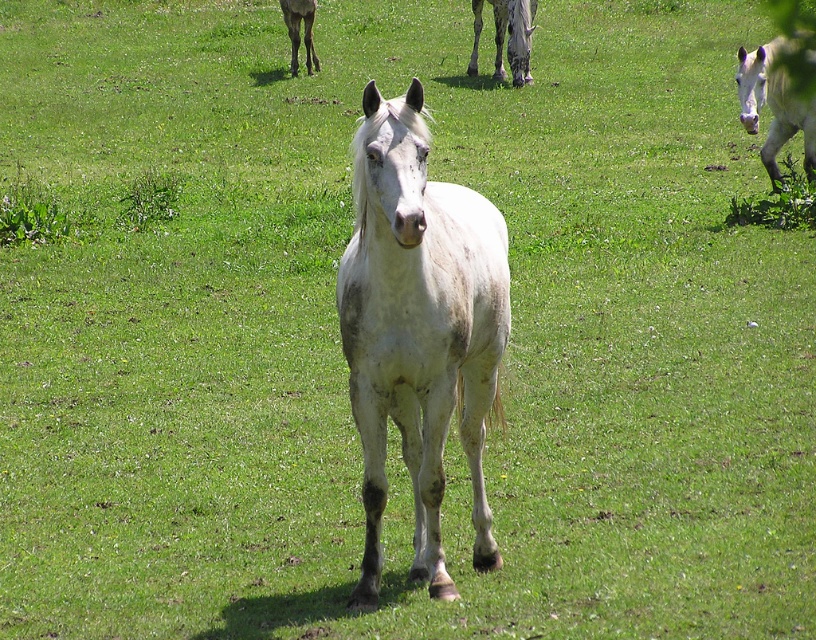
From the picture: You are a photographer trying to capture both the white matte horse at upper right and the speckled gray horse at upper center in a single frame. Based on their sizes in the image, which horse should you focus on to ensure both fit comfortably in the photo?

The white matte horse at upper right occupies less space than the speckled gray horse at upper center. To ensure both fit comfortably in the photo, focus on the speckled gray horse at upper center as it is larger and will help balance the composition.

You are standing at the origin point in the image. There is a white matte horse at upper right represented by point (x=774, y=106). Which direction should you move to reach the white matte horse at upper right?

The white matte horse at upper right is located at point (x=774, y=106), so you should move towards the upper right direction to reach it.

You are standing at point (384, 236) and want to walk to point (511, 32). Which direction should you move in?

You should move backward since point (384, 236) is in front of point (511, 32).